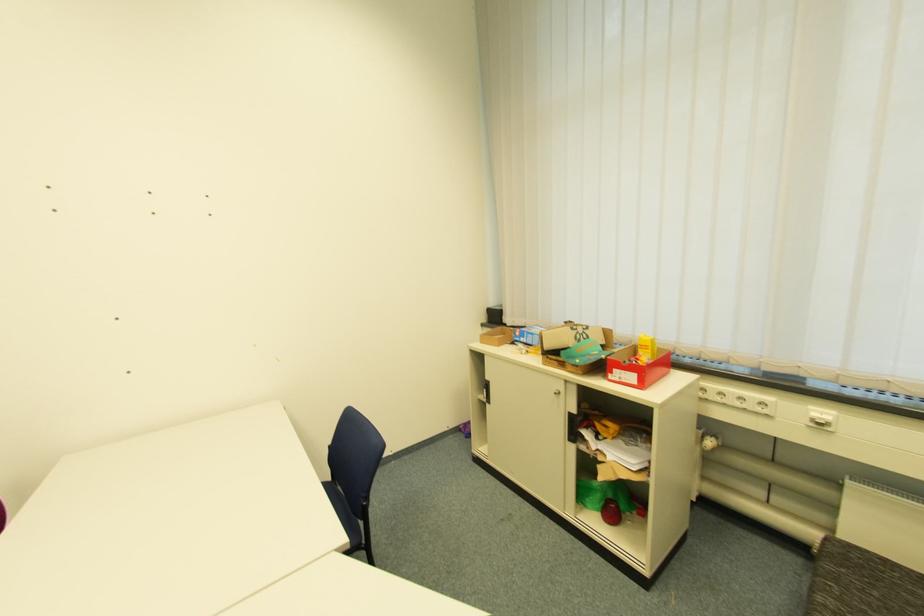
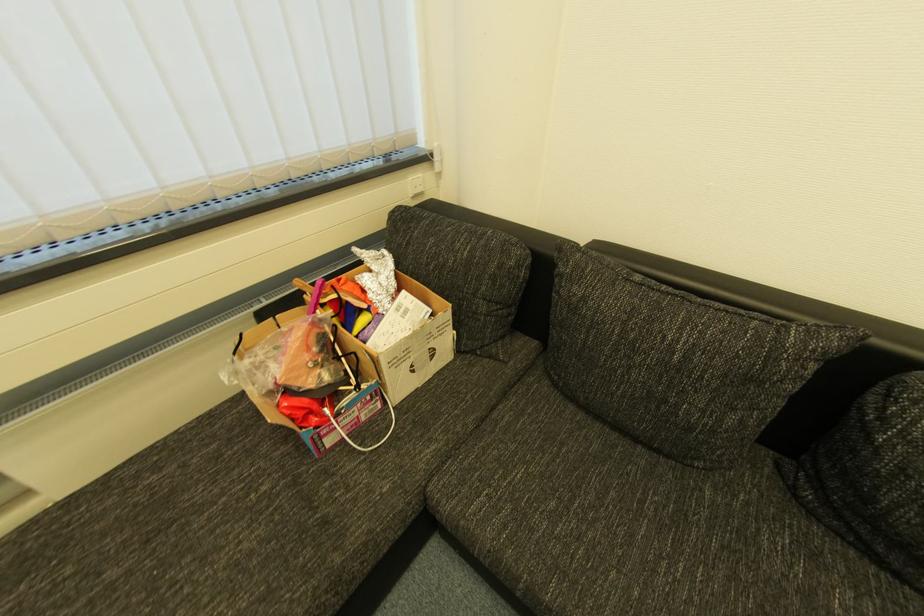
First-person continuous shooting, in which direction is the camera rotating?

The camera's rotation is toward right-down.